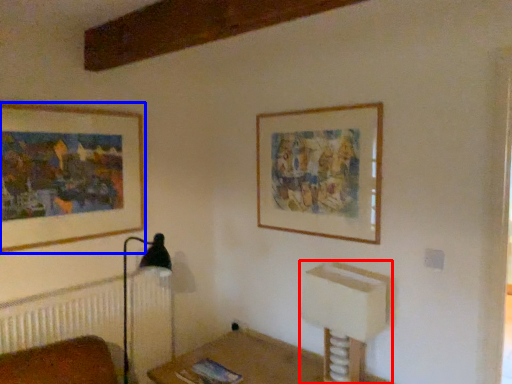
Question: Which object is further to the camera taking this photo, vanity (highlighted by a red box) or picture frame (highlighted by a blue box)?

Choices:
 (A) vanity
 (B) picture frame

Answer: (B)